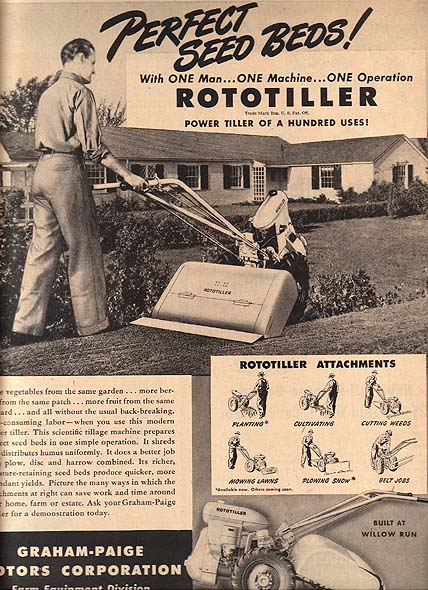
You are a GUI agent. You are given a task and a screenshot of the screen. Output one action in this format:
    pyautogui.click(x=<x>, y=<y>)
    Task: Click on the beds
    The image size is (428, 590).
    Given the screenshot: What is the action you would take?
    pyautogui.click(x=297, y=29)